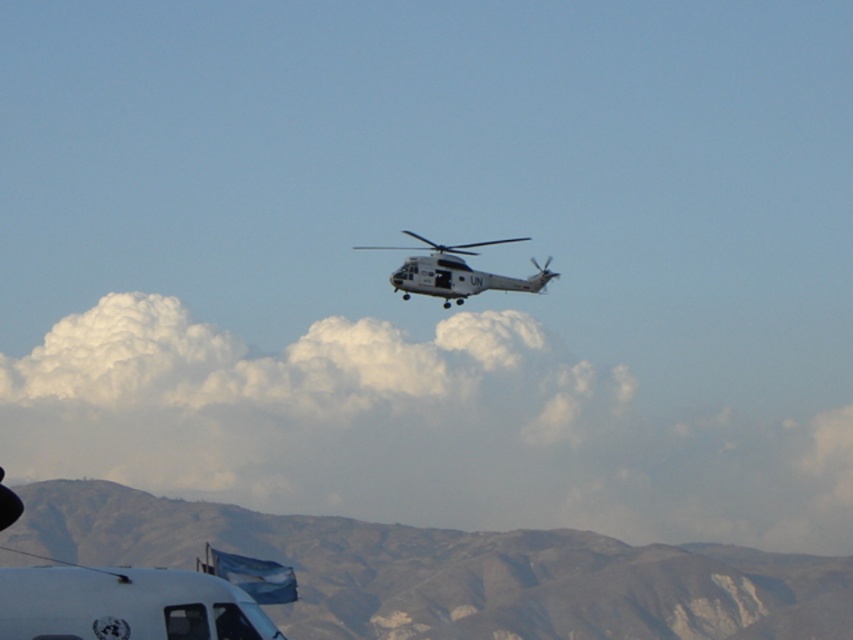
You are a pilot flying a helicopter marked with UN insignia. You need to land on a flat area near the point at coordinates point (454, 572). Is the area around this point suitable for landing?

The point (454, 572) is on a gray rocky mountain at lower center, which is not a flat area. Therefore, the area around this point is not suitable for landing a helicopter.

You are a drone pilot trying to navigate your drone between the gray rocky mountain at lower center and the white matte helicopter at center. The drone has a maximum flight distance of 60 feet. Can the drone safely travel between them without exceeding its range?

The gray rocky mountain at lower center and the white matte helicopter at center are 64.60 feet apart. Since the drone can only fly up to 60 feet, it cannot safely travel between them without exceeding its range.

You are a pilot flying the white matte helicopter at center. You need to land on the gray rocky mountain at lower center. Is the helicopter currently directly above the landing zone?

The gray rocky mountain at lower center is positioned under the white matte helicopter at center, so yes, the helicopter is directly above the landing zone.